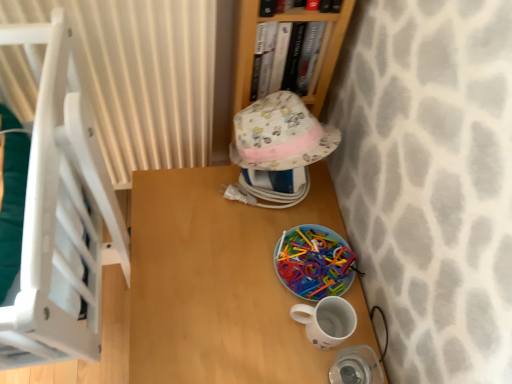
This screenshot has width=512, height=384. I want to click on space that is in front of fluffy cotton hat at center, so click(x=229, y=247).